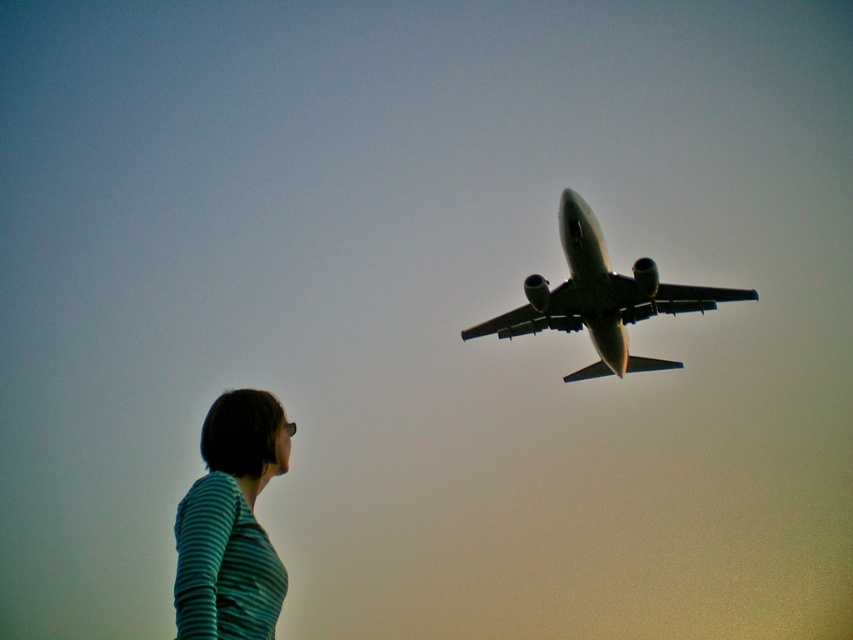
Question: Which object is closer to the camera taking this photo?

Choices:
 (A) teal striped shirt at lower left
 (B) metallic gray airplane at upper center

Answer: (A)

Question: Which object is farther from the camera taking this photo?

Choices:
 (A) teal striped shirt at lower left
 (B) metallic gray airplane at upper center

Answer: (B)

Question: Is the position of teal striped shirt at lower left less distant than that of metallic gray airplane at upper center?

Choices:
 (A) yes
 (B) no

Answer: (A)

Question: Where is teal striped shirt at lower left located in relation to metallic gray airplane at upper center in the image?

Choices:
 (A) above
 (B) below

Answer: (A)

Question: Which object appears closest to the camera in this image?

Choices:
 (A) teal striped shirt at lower left
 (B) metallic gray airplane at upper center

Answer: (A)

Question: Can you confirm if teal striped shirt at lower left is bigger than metallic gray airplane at upper center?

Choices:
 (A) yes
 (B) no

Answer: (A)